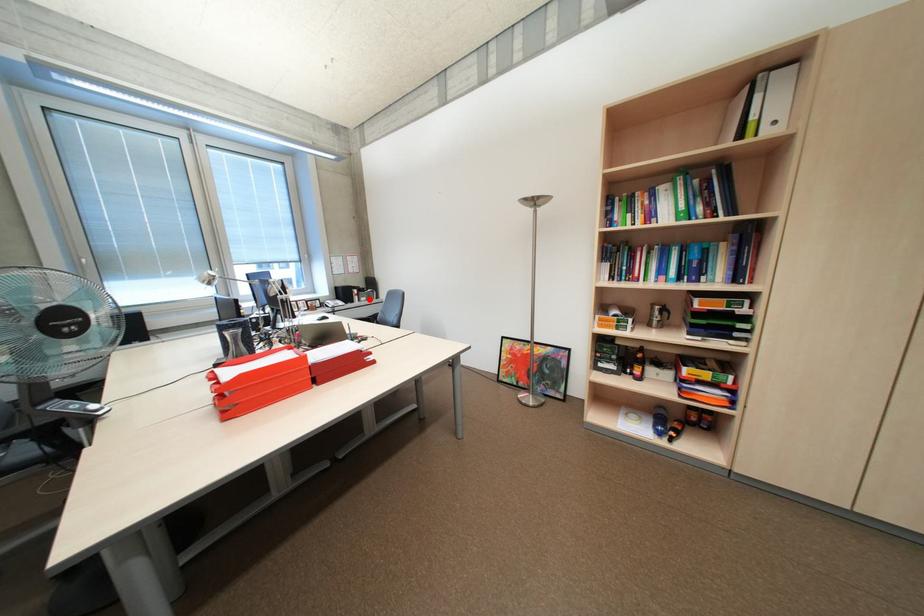
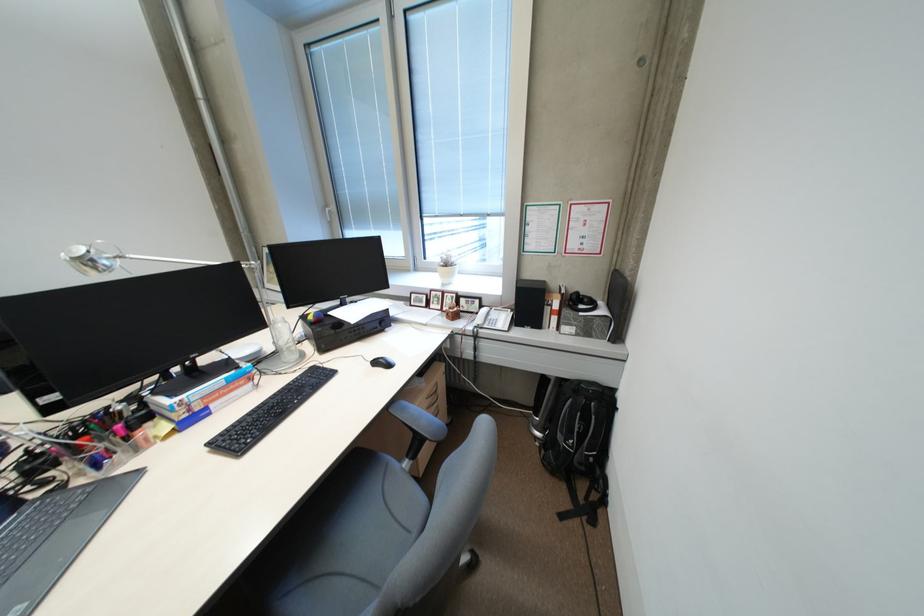
Locate, in the second image, the point that corresponds to the highlighted location in the first image.

(568, 328)